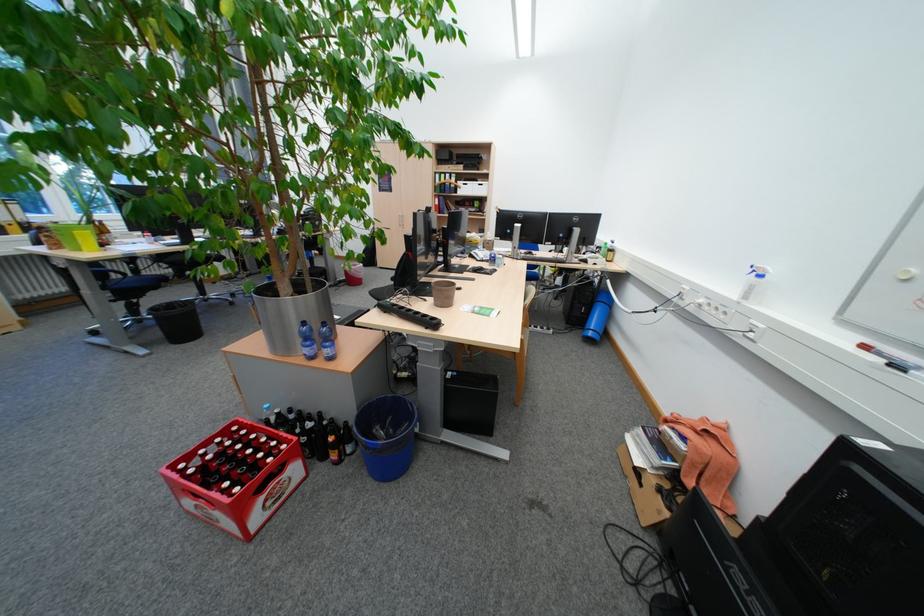
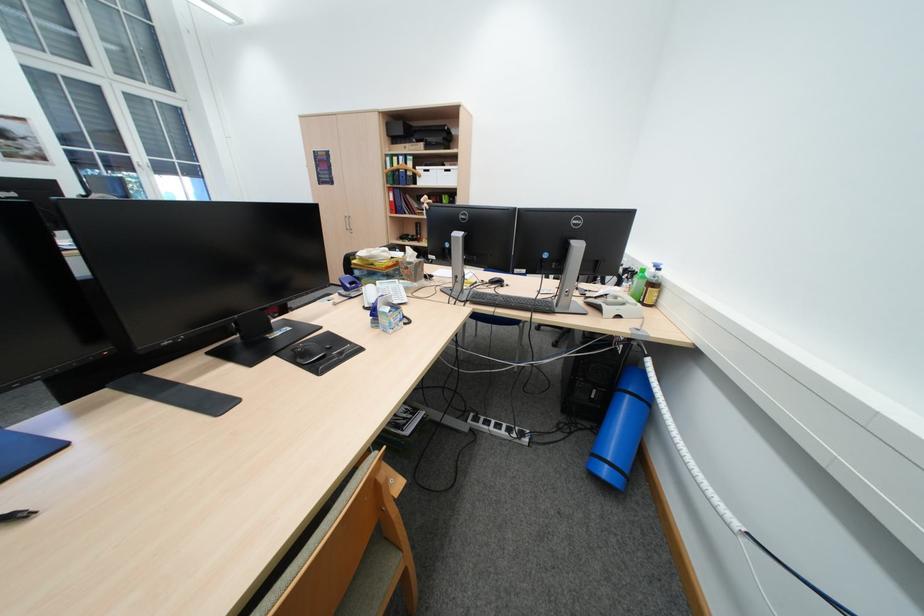
Locate, in the second image, the point that corresponds to (x=602, y=334) in the first image.

(616, 472)